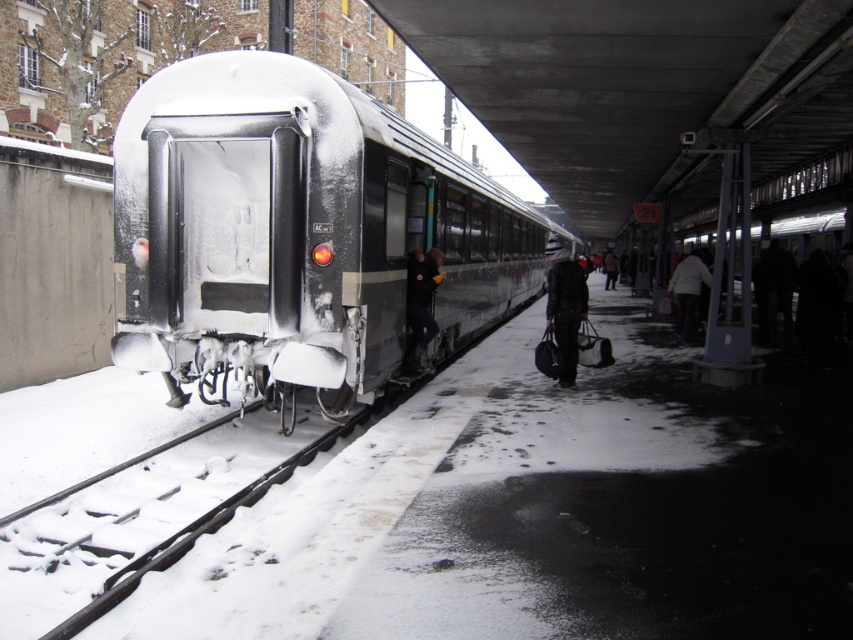
Who is more forward, (212, 81) or (409, 275)?

Point (212, 81) is in front.

Consider the image. Can you confirm if silver metallic train at center is positioned to the right of dark blue jacket at center?

Yes, silver metallic train at center is to the right of dark blue jacket at center.

I want to click on silver metallic train at center, so click(x=299, y=234).

I want to click on silver metallic train at center, so click(x=299, y=234).

Is snow-covered metal track at lower left taller than dark gray jacket at center?

Yes.

Does snow-covered metal track at lower left appear over dark gray jacket at center?

No.

Which is in front, point (230, 477) or point (674, 273)?

Point (230, 477)

The width and height of the screenshot is (853, 640). I want to click on snow-covered metal track at lower left, so click(144, 516).

Consider the image. Can you confirm if silver metallic train at center is bigger than dark brown leather jacket at center?

Yes, silver metallic train at center is bigger than dark brown leather jacket at center.

Which is more to the left, silver metallic train at center or dark brown leather jacket at center?

silver metallic train at center

The image size is (853, 640). Describe the element at coordinates (299, 234) in the screenshot. I see `silver metallic train at center` at that location.

You are a GUI agent. You are given a task and a screenshot of the screen. Output one action in this format:
    pyautogui.click(x=<x>, y=<y>)
    Task: Click on the silver metallic train at center
    
    Given the screenshot: What is the action you would take?
    pyautogui.click(x=299, y=234)